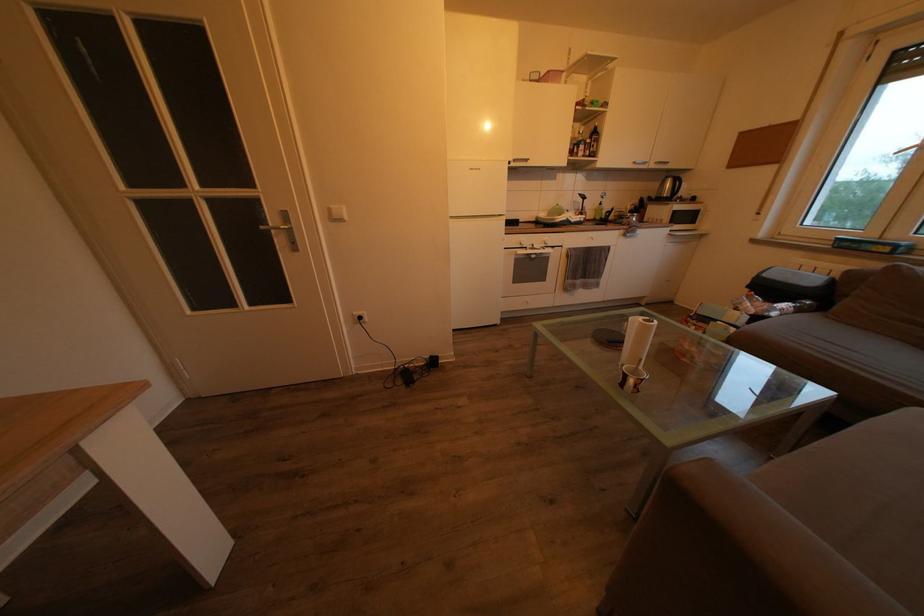
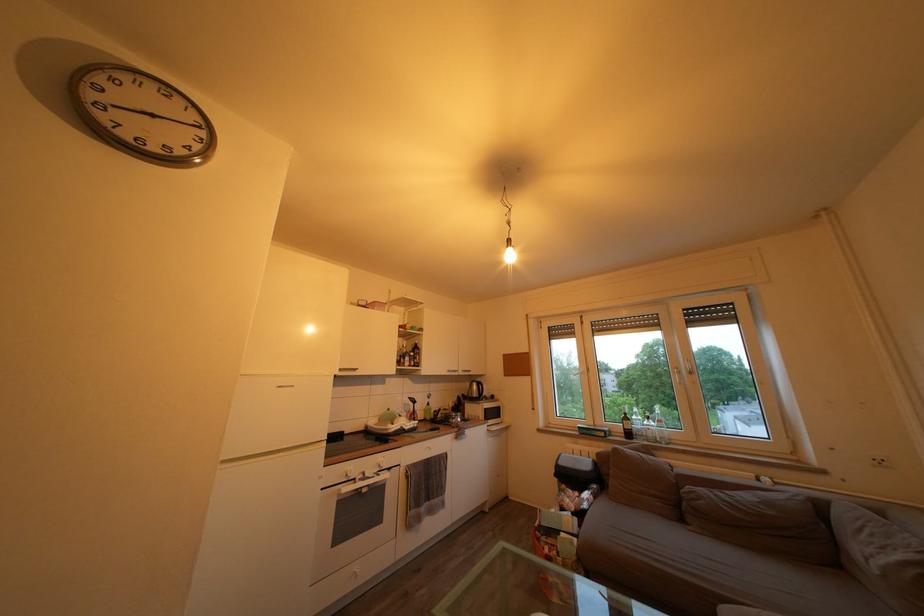
The point at (673, 237) is marked in the first image. Where is the corresponding point in the second image?

(492, 434)